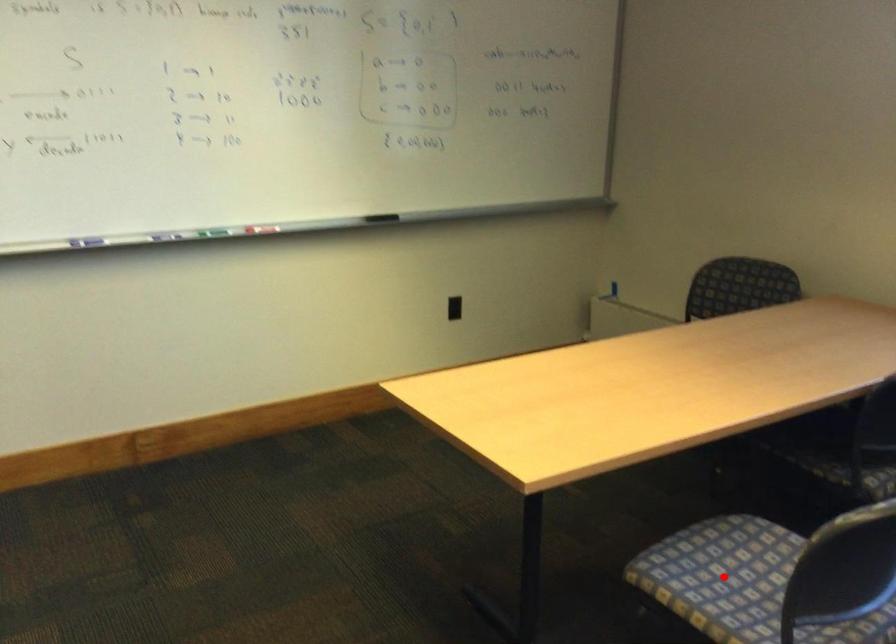
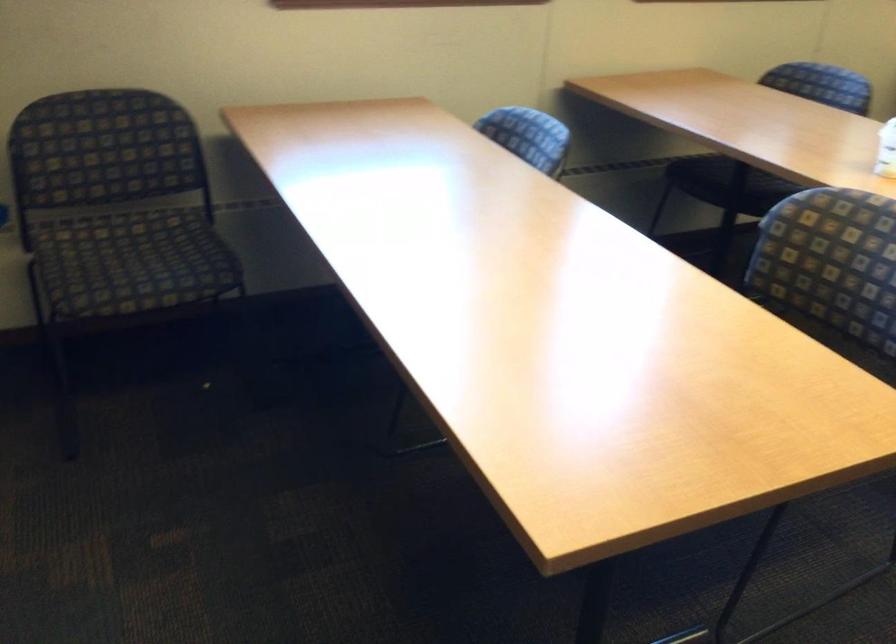
Question: I am providing you with two images of the same scene from different viewpoints. A red point is marked on the first image. Is the red point's position out of view in image 2?

Choices:
 (A) Yes
 (B) No

Answer: (A)